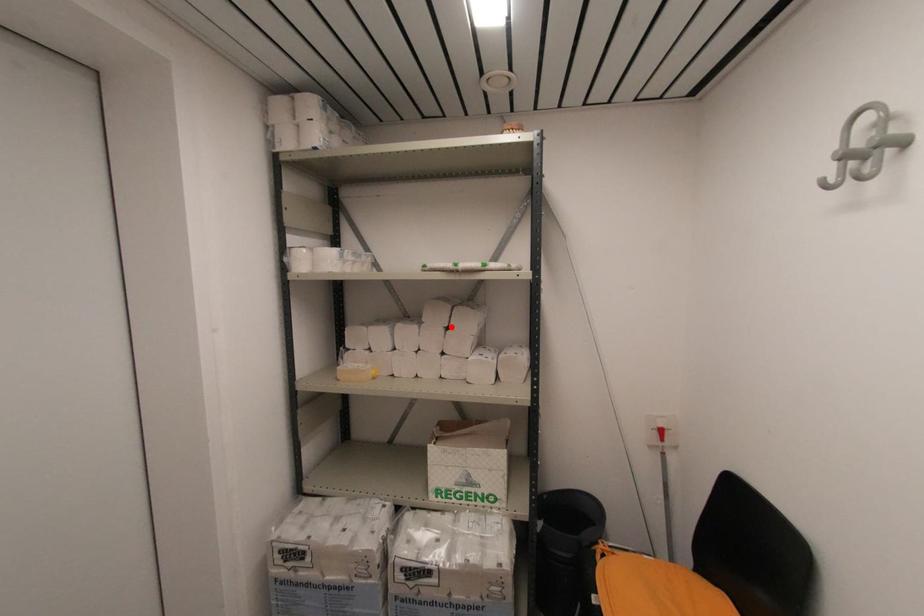
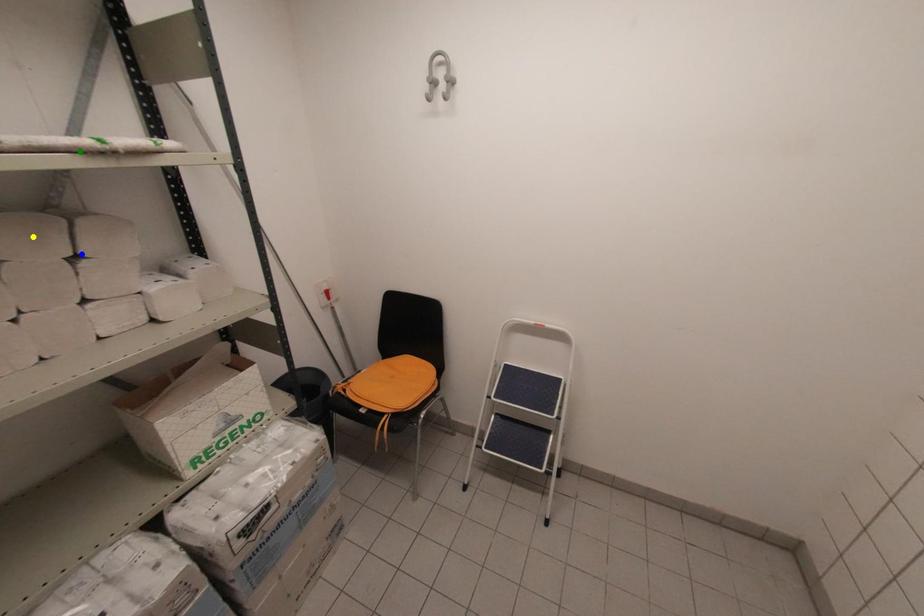
Question: I am providing you with two images of the same scene from different viewpoints. A red point is marked on the first image. You are given multiple points on the second image. In image 2, which mark is for the same physical point as the one in image 1?

Choices:
 (A) green point
 (B) blue point
 (C) yellow point

Answer: (B)